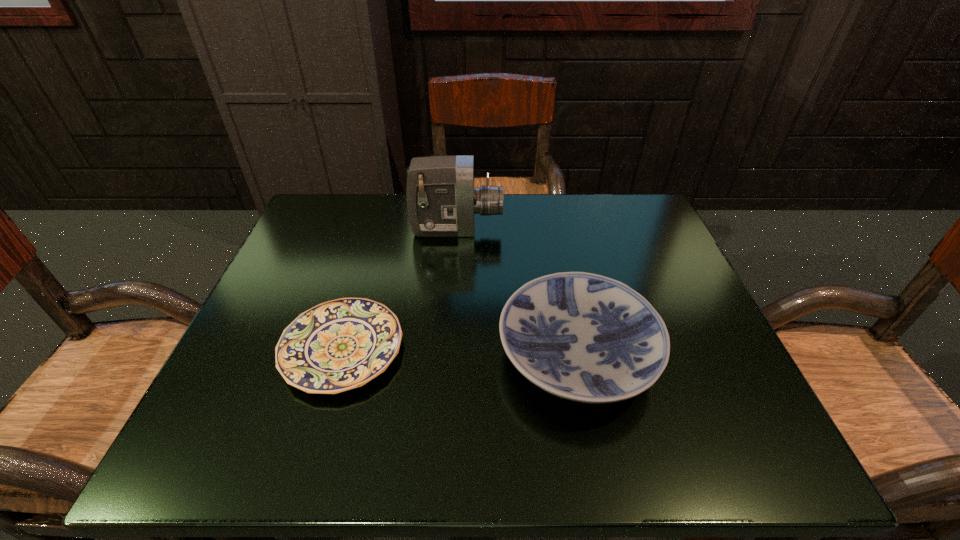
Find the location of a particular element. The width and height of the screenshot is (960, 540). the tallest object is located at coordinates (441, 199).

Where is `the farthest object`? The width and height of the screenshot is (960, 540). the farthest object is located at coordinates (441, 199).

I want to click on the second tallest object, so click(584, 337).

The image size is (960, 540). In order to click on the right plate in this screenshot , I will do `click(584, 337)`.

Locate an element on the screen. The width and height of the screenshot is (960, 540). the shorter plate is located at coordinates (339, 345).

Image resolution: width=960 pixels, height=540 pixels. What are the coordinates of `the left plate` in the screenshot? It's located at (339, 345).

Find the location of a particular element. The image size is (960, 540). vacant space located at the front of the camcorder, highlighting the lens is located at coordinates (639, 230).

You are a GUI agent. You are given a task and a screenshot of the screen. Output one action in this format:
    pyautogui.click(x=<x>, y=<y>)
    Task: Click on the vacant region located 0.100m on the right of the second shortest object
    This screenshot has width=960, height=540.
    Given the screenshot: What is the action you would take?
    pyautogui.click(x=710, y=354)

Locate an element on the screen. The width and height of the screenshot is (960, 540). free spot located 0.370m on the right of the left plate is located at coordinates (603, 349).

Where is `object that is at the far edge`? The image size is (960, 540). object that is at the far edge is located at coordinates (441, 199).